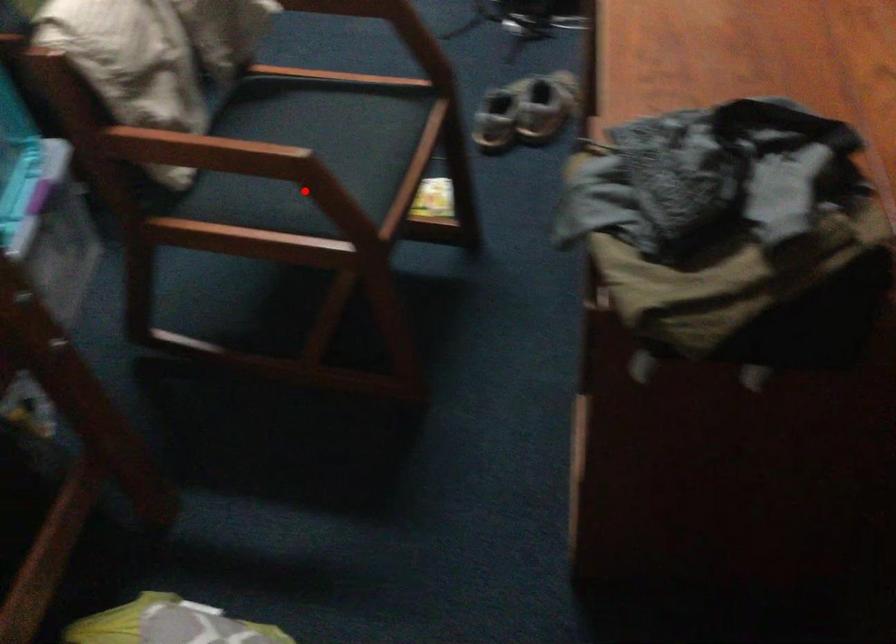
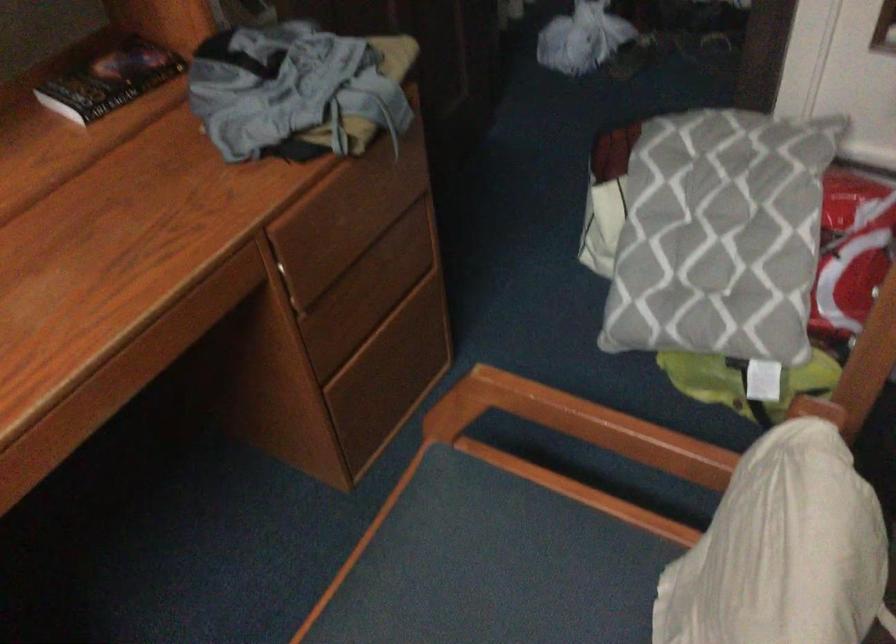
The point at the highlighted location is marked in the first image. Where is the corresponding point in the second image?

(549, 580)